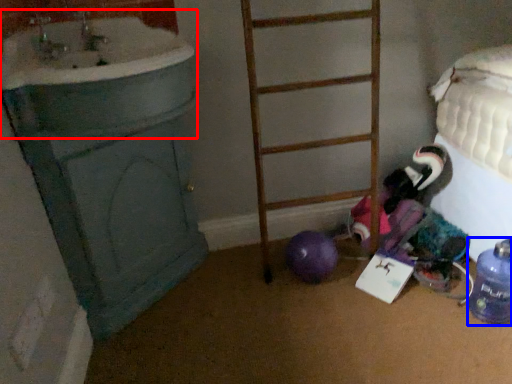
Question: Which of the following is the closest to the observer, sink (highlighted by a red box) or bottle (highlighted by a blue box)?

Choices:
 (A) sink
 (B) bottle

Answer: (A)